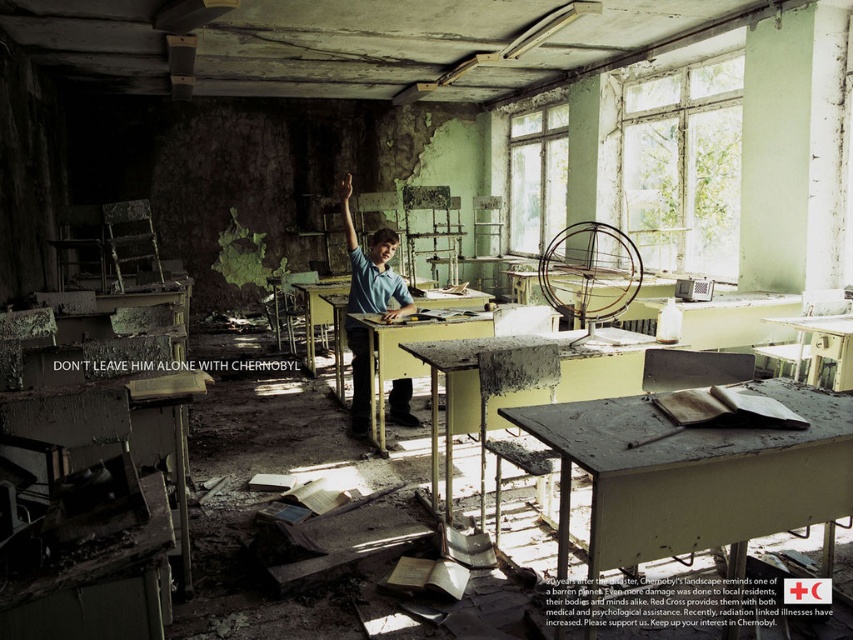
Question: Is blue shirt at center to the right of yellow matte desk at center from the viewer's perspective?

Choices:
 (A) no
 (B) yes

Answer: (B)

Question: Which point appears closest to the camera in this image?

Choices:
 (A) (354, 394)
 (B) (335, 324)
 (C) (532, 401)

Answer: (C)

Question: Can you confirm if metallic yellow table at center is positioned above matte gray desk at center?

Choices:
 (A) yes
 (B) no

Answer: (B)

Question: Does blue shirt at center have a smaller size compared to yellow matte desk at center?

Choices:
 (A) no
 (B) yes

Answer: (B)

Question: Which point appears farthest from the camera in this image?

Choices:
 (A) (335, 378)
 (B) (624, 387)
 (C) (810, 323)
 (D) (390, 417)

Answer: (A)

Question: Among these points, which one is farthest from the camera?

Choices:
 (A) (482, 301)
 (B) (799, 317)
 (C) (657, 452)

Answer: (A)